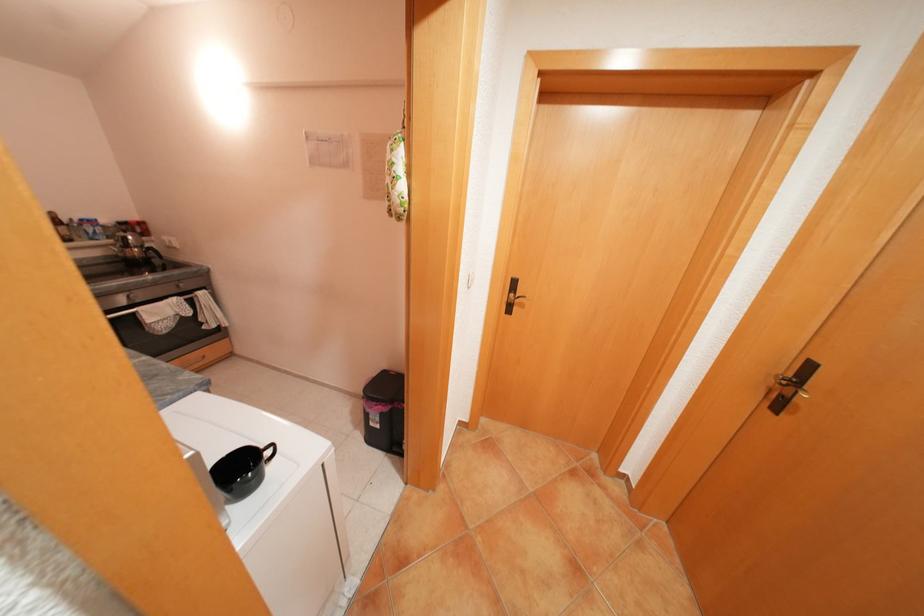
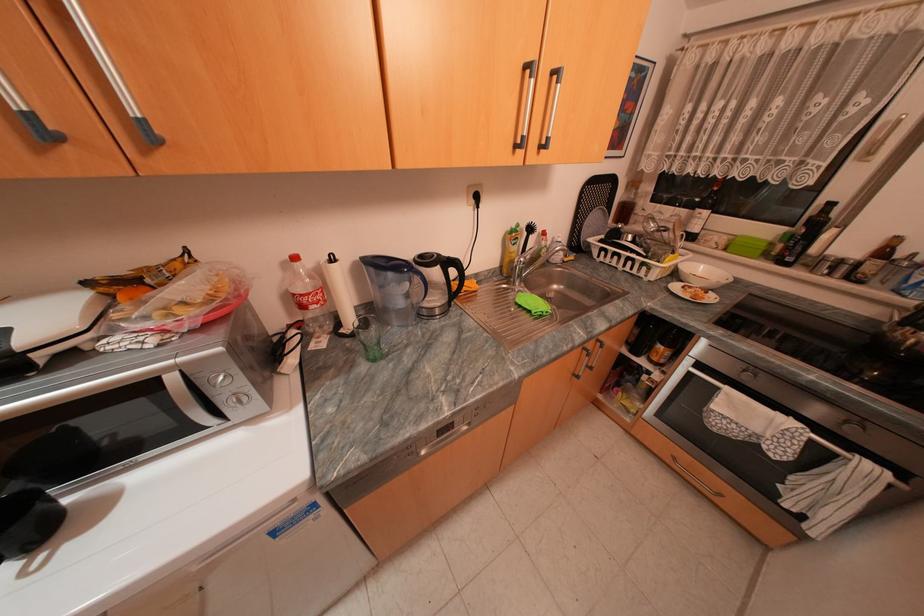
Locate, in the second image, the point that corresponds to pixel 146 313 in the first image.

(727, 389)